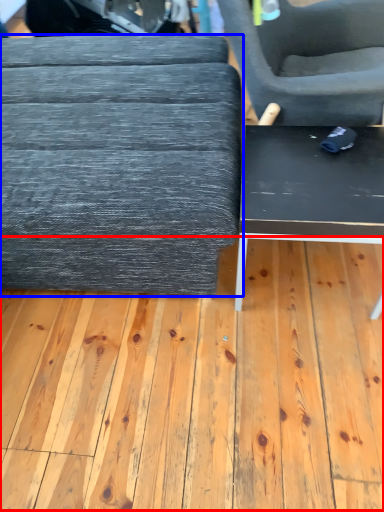
Question: Which of the following is the closest to the observer, plywood (highlighted by a red box) or table (highlighted by a blue box)?

Choices:
 (A) plywood
 (B) table

Answer: (B)